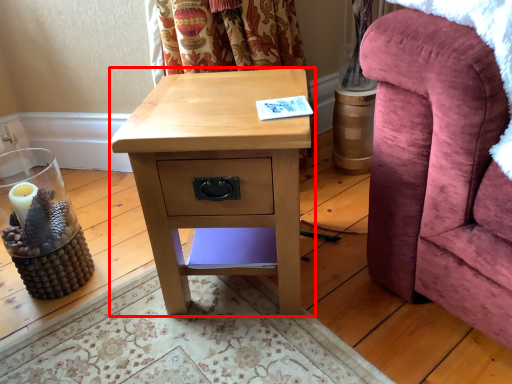
Question: Considering the relative positions of nightstand (annotated by the red box) and furniture in the image provided, where is nightstand (annotated by the red box) located with respect to the staircase?

Choices:
 (A) right
 (B) left

Answer: (B)